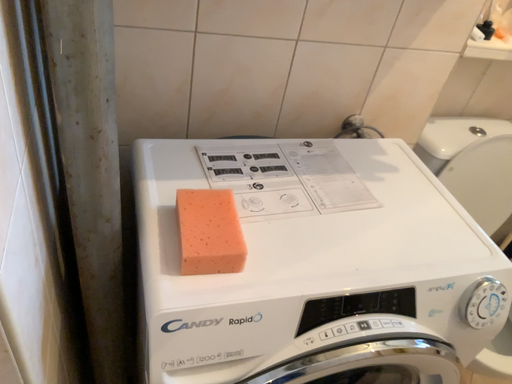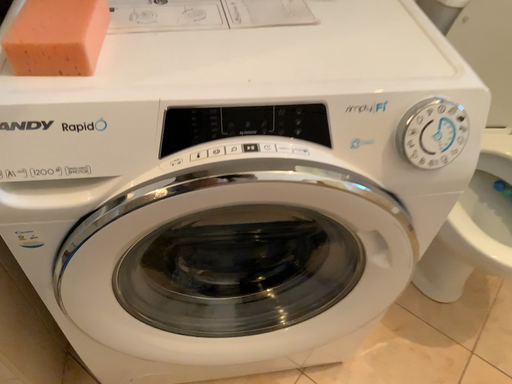
Question: Which way did the camera rotate in the video?

Choices:
 (A) rotated right
 (B) rotated left

Answer: (B)